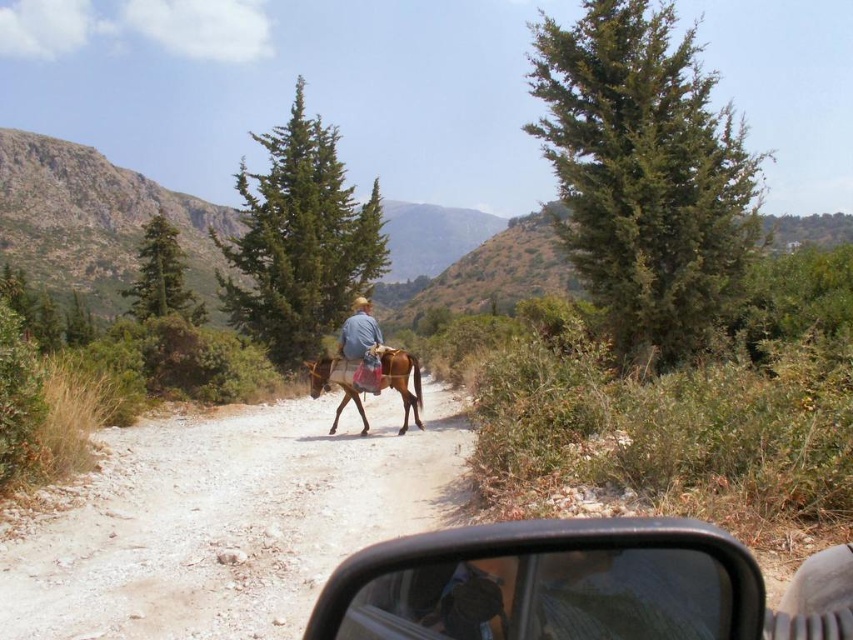
Question: Which point is farther to the camera?

Choices:
 (A) (160, 216)
 (B) (579, 83)
 (C) (270, 481)
 (D) (409, 568)

Answer: (A)

Question: Does brown glossy horse at center appear on the right side of blue denim jacket at center?

Choices:
 (A) yes
 (B) no

Answer: (B)

Question: Can you confirm if brown gravel road at center is positioned below green textured pine at upper left?

Choices:
 (A) yes
 (B) no

Answer: (A)

Question: Observing the image, what is the correct spatial positioning of metallic gray car at lower center in reference to blue denim jacket at center?

Choices:
 (A) right
 (B) left

Answer: (A)

Question: Which object is the farthest from the brown gravel road at center?

Choices:
 (A) green textured pine at center
 (B) brown glossy horse at center
 (C) blue denim jacket at center

Answer: (A)

Question: Which object appears closest to the camera in this image?

Choices:
 (A) blue denim jacket at center
 (B) green needle-like pine at upper right

Answer: (B)